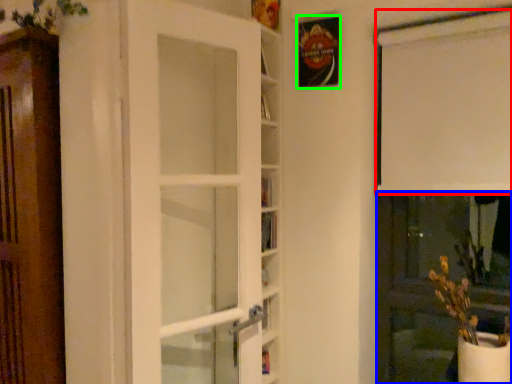
Question: Estimate the real-world distances between objects in this image. Which object is closer to curtain (highlighted by a red box), screen door (highlighted by a blue box) or picture frame (highlighted by a green box)?

Choices:
 (A) screen door
 (B) picture frame

Answer: (B)